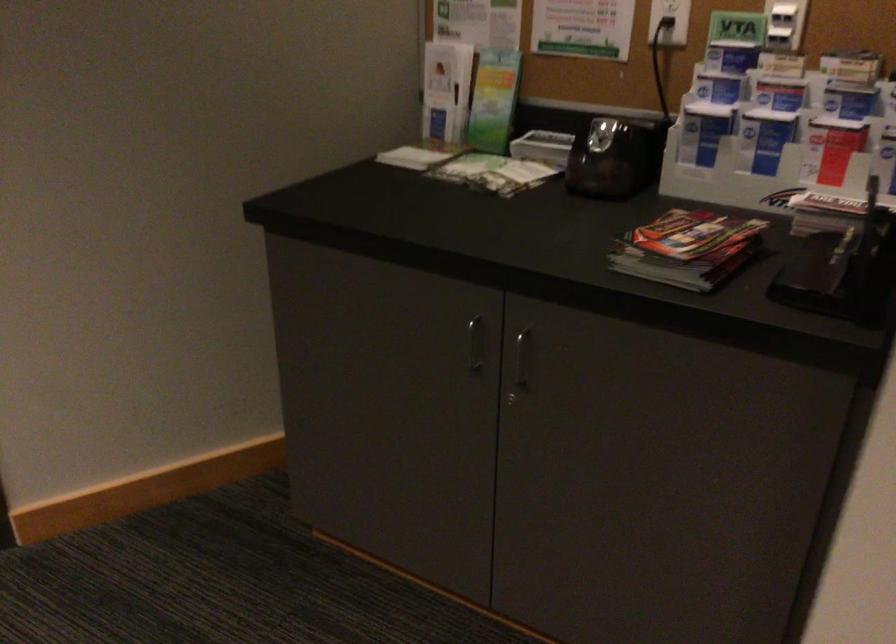
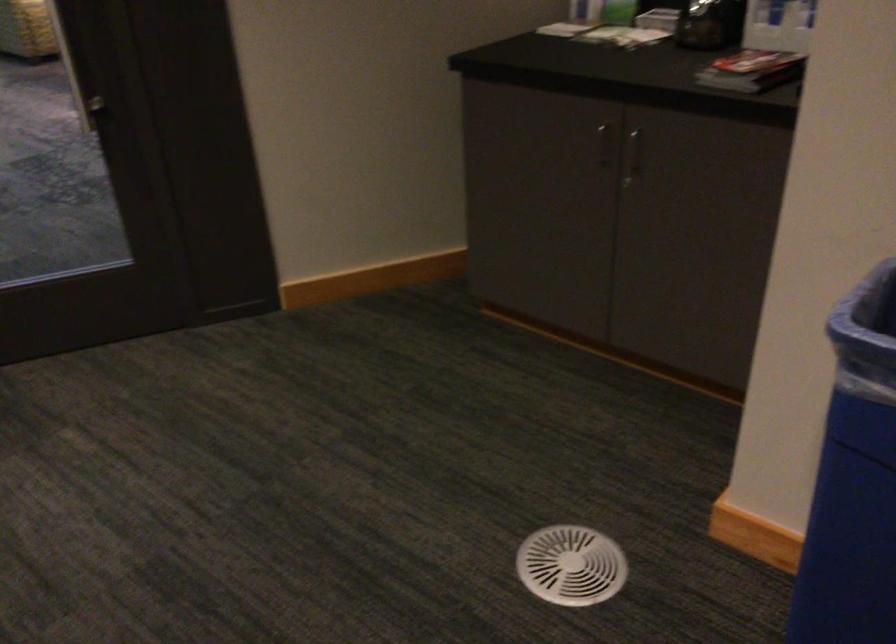
Question: Which direction would the cameraman need to move to produce the second image? Reply with the corresponding letter.

Choices:
 (A) Left
 (B) Right
 (C) Forward
 (D) Backward

Answer: (D)